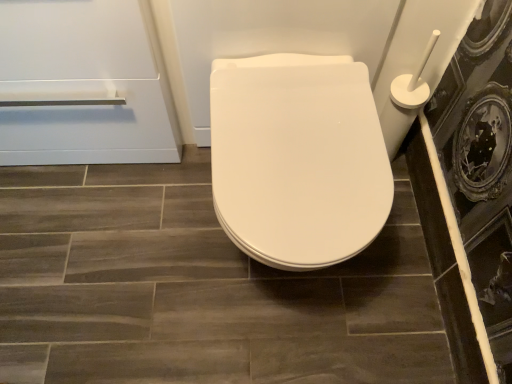
Image resolution: width=512 pixels, height=384 pixels. I want to click on transparent glass screen door at right, so click(473, 192).

The width and height of the screenshot is (512, 384). What do you see at coordinates (197, 289) in the screenshot?
I see `matte ceramic tile at center` at bounding box center [197, 289].

Describe the element at coordinates (301, 40) in the screenshot. The width and height of the screenshot is (512, 384). I see `white glossy toilet seat at center` at that location.

The image size is (512, 384). What are the coordinates of `transparent glass screen door at right` in the screenshot? It's located at (473, 192).

From a real-world perspective, is white glossy toilet seat at center located beneath matte ceramic tile at center?

Incorrect, from a real-world perspective, white glossy toilet seat at center is higher than matte ceramic tile at center.

Are white glossy toilet seat at center and matte ceramic tile at center located far from each other?

white glossy toilet seat at center is actually quite close to matte ceramic tile at center.

Between point (273, 3) and point (166, 332), which one is positioned in front?

The point (273, 3) is closer.

Which object is further away from the camera taking this photo, white glossy toilet seat at center or matte ceramic tile at center?

matte ceramic tile at center is more distant.

At what (x,y) coordinates should I click in order to perform the action: click on toilet located above the matte ceramic tile at center (from a real-world perspective). Please return your answer as a coordinate pair (x, y). Looking at the image, I should click on click(x=297, y=159).

Does matte ceramic tile at center have a smaller size compared to white glossy toilet seat at center?

Indeed, matte ceramic tile at center has a smaller size compared to white glossy toilet seat at center.

Is point (44, 381) positioned before point (327, 100)?

No, it is not.

From a real-world perspective, which is physically below, transparent glass screen door at right or white glossy toilet seat at center?

transparent glass screen door at right.

Based on the photo, considering the relative sizes of transparent glass screen door at right and white glossy toilet seat at center in the image provided, is transparent glass screen door at right bigger than white glossy toilet seat at center?

Incorrect, transparent glass screen door at right is not larger than white glossy toilet seat at center.

Which of these two, transparent glass screen door at right or white glossy toilet seat at center, is wider?

With larger width is white glossy toilet seat at center.

Relative to white glossy toilet seat at center, is transparent glass screen door at right in front or behind?

transparent glass screen door at right is behind white glossy toilet seat at center.

Looking at this image, considering the sizes of objects matte ceramic tile at center and transparent glass screen door at right in the image provided, who is wider, matte ceramic tile at center or transparent glass screen door at right?

matte ceramic tile at center is wider.

From a real-world perspective, relative to transparent glass screen door at right, is matte ceramic tile at center vertically above or below?

matte ceramic tile at center is situated lower than transparent glass screen door at right in the real world.

From the image's perspective, who appears lower, matte ceramic tile at center or transparent glass screen door at right?

matte ceramic tile at center, from the image's perspective.

Can we say matte ceramic tile at center lies outside transparent glass screen door at right?

matte ceramic tile at center is positioned outside transparent glass screen door at right.

The height and width of the screenshot is (384, 512). In order to click on toilet below the white glossy toilet seat at center (from a real-world perspective) in this screenshot , I will do `click(297, 159)`.

From a real-world perspective, between white glossy toilet seat at center and white glossy toilet seat at center, who is vertically higher?

From a 3D spatial view, white glossy toilet seat at center is above.

Is white glossy toilet seat at center oriented away from white glossy toilet seat at center?

That's not correct — white glossy toilet seat at center is not looking away from white glossy toilet seat at center.

From the image's perspective, is white glossy toilet seat at center located above or below white glossy toilet seat at center?

Based on their image positions, white glossy toilet seat at center is located above white glossy toilet seat at center.

What are the coordinates of `toilet on the right of matte ceramic tile at center` in the screenshot? It's located at (297, 159).

Considering the relative sizes of white glossy toilet seat at center and matte ceramic tile at center in the image provided, is white glossy toilet seat at center smaller than matte ceramic tile at center?

No.

Considering the positions of objects white glossy toilet seat at center and matte ceramic tile at center in the image provided, who is more to the left, white glossy toilet seat at center or matte ceramic tile at center?

Positioned to the left is matte ceramic tile at center.

From a real-world perspective, who is located lower, white glossy toilet seat at center or transparent glass screen door at right?

transparent glass screen door at right is physically lower.

I want to click on screen door behind the white glossy toilet seat at center, so click(473, 192).

From the image's perspective, which object appears higher, white glossy toilet seat at center or transparent glass screen door at right?

white glossy toilet seat at center, from the image's perspective.

Is white glossy toilet seat at center in contact with transparent glass screen door at right?

No.

In the image, there is a white glossy toilet seat at center. Where is `ceramic tile below it (from the image's perspective)`? This screenshot has width=512, height=384. ceramic tile below it (from the image's perspective) is located at coordinates (197, 289).

Where is `toilet in front of the matte ceramic tile at center`? toilet in front of the matte ceramic tile at center is located at coordinates (297, 159).

When comparing their distances from white glossy toilet seat at center, does white glossy toilet seat at center or transparent glass screen door at right seem closer?

white glossy toilet seat at center is closer to white glossy toilet seat at center.

Estimate the real-world distances between objects in this image. Which object is further from white glossy toilet seat at center, white glossy toilet seat at center or transparent glass screen door at right?

Based on the image, transparent glass screen door at right appears to be further to white glossy toilet seat at center.

In the scene shown: Looking at the image, which one is located further to matte ceramic tile at center, white glossy toilet seat at center or white glossy toilet seat at center?

Based on the image, white glossy toilet seat at center appears to be further to matte ceramic tile at center.

Which object lies further to the anchor point white glossy toilet seat at center, matte ceramic tile at center or transparent glass screen door at right?

The object further to white glossy toilet seat at center is matte ceramic tile at center.

Considering their positions, is matte ceramic tile at center positioned closer to white glossy toilet seat at center than white glossy toilet seat at center?

Based on the image, white glossy toilet seat at center appears to be nearer to white glossy toilet seat at center.

Which object lies further to the anchor point matte ceramic tile at center, transparent glass screen door at right or white glossy toilet seat at center?

transparent glass screen door at right is further to matte ceramic tile at center.

Considering their positions, is matte ceramic tile at center positioned closer to transparent glass screen door at right than white glossy toilet seat at center?

The object closer to transparent glass screen door at right is white glossy toilet seat at center.

Based on the photo, based on their spatial positions, is white glossy toilet seat at center or transparent glass screen door at right further from matte ceramic tile at center?

Based on the image, transparent glass screen door at right appears to be further to matte ceramic tile at center.

This screenshot has width=512, height=384. Identify the location of toilet between white glossy toilet seat at center and transparent glass screen door at right from top to bottom. (297, 159).

You are a GUI agent. You are given a task and a screenshot of the screen. Output one action in this format:
    pyautogui.click(x=<x>, y=<y>)
    Task: Click on the bath situated between matte ceramic tile at center and transparent glass screen door at right from left to right
    Image resolution: width=512 pixels, height=384 pixels.
    Given the screenshot: What is the action you would take?
    pyautogui.click(x=301, y=40)

Find the location of `toilet that lies between white glossy toilet seat at center and matte ceramic tile at center from top to bottom`. toilet that lies between white glossy toilet seat at center and matte ceramic tile at center from top to bottom is located at coordinates (297, 159).

Where is `toilet between matte ceramic tile at center and transparent glass screen door at right`? toilet between matte ceramic tile at center and transparent glass screen door at right is located at coordinates [x=297, y=159].